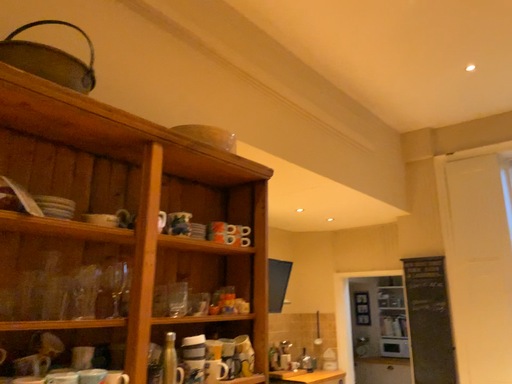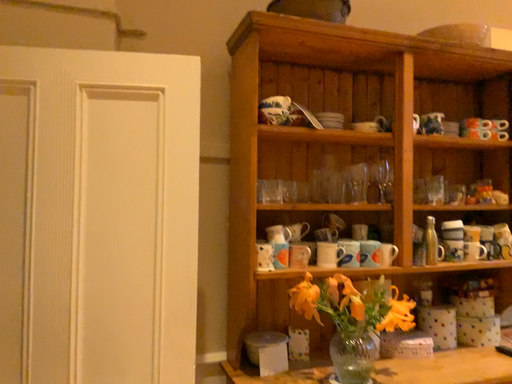
Question: Which way did the camera rotate in the video?

Choices:
 (A) rotated left
 (B) rotated right

Answer: (A)